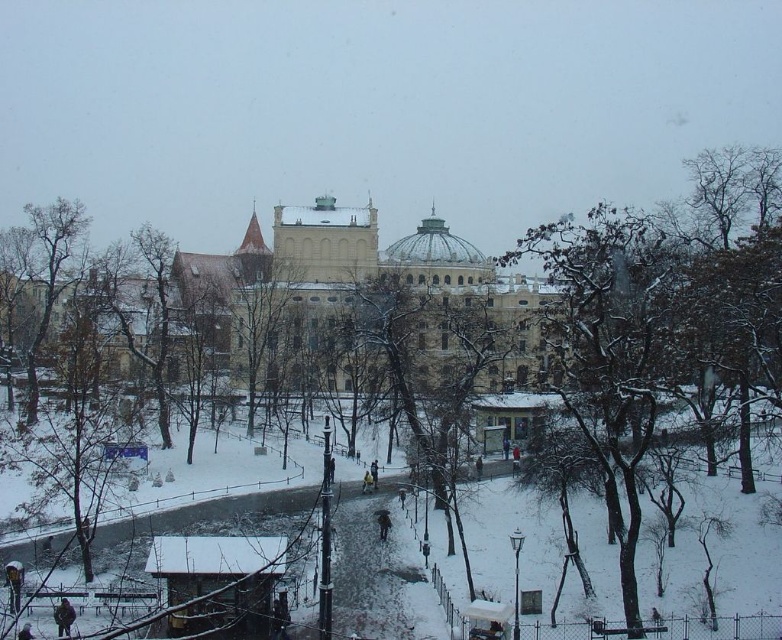
Question: Can you confirm if snow-covered tree at center is positioned above brown textured tree at left?

Choices:
 (A) yes
 (B) no

Answer: (B)

Question: Does snow-covered tree at center lie in front of brown textured tree at left?

Choices:
 (A) no
 (B) yes

Answer: (B)

Question: Which object appears closest to the camera in this image?

Choices:
 (A) snow-covered tree at center
 (B) brown textured tree at left

Answer: (A)

Question: Among these objects, which one is farthest from the camera?

Choices:
 (A) brown textured tree at left
 (B) snow-covered tree at center

Answer: (A)

Question: Can you confirm if snow-covered tree at center is positioned above brown textured tree at left?

Choices:
 (A) yes
 (B) no

Answer: (B)